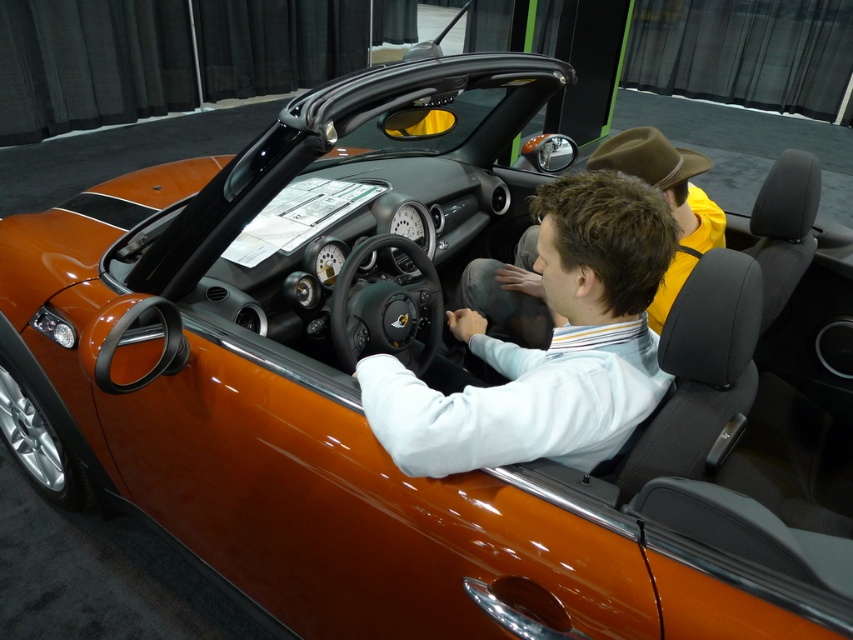
You are a photographer standing in front of the orange convertible car at the exhibition. You need to capture a photo that includes both the matte white shirt at center and the matte brown hat at center. Based on their positions, which one should you focus on first to ensure both are in frame?

The matte white shirt at center is below the matte brown hat at center, so you should focus on the matte brown hat at center first to ensure both are in frame.